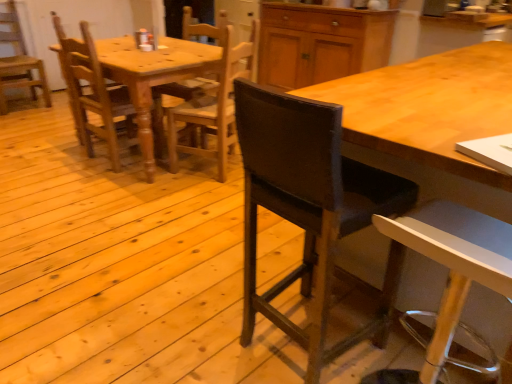
Question: Is the depth of wooden desk at center less than that of wooden chair at left, the 1th chair in the back-to-front sequence?

Choices:
 (A) yes
 (B) no

Answer: (A)

Question: Is wooden chair at left, placed as the 5th chair when sorted from right to left, a part of wooden desk at center?

Choices:
 (A) no
 (B) yes

Answer: (A)

Question: Is wooden desk at center bigger than wooden chair at left, the 1th chair in the back-to-front sequence?

Choices:
 (A) yes
 (B) no

Answer: (A)

Question: Could you tell me if wooden desk at center is facing wooden chair at left, placed as the 1th chair when sorted from left to right?

Choices:
 (A) yes
 (B) no

Answer: (A)

Question: Is wooden desk at center with wooden chair at left, placed as the 1th chair when sorted from left to right?

Choices:
 (A) no
 (B) yes

Answer: (A)

Question: Relative to wooden chair at left, the 5th chair viewed from the front, is dark brown leather chair at center, acting as the fourth chair starting from the back, in front or behind?

Choices:
 (A) front
 (B) behind

Answer: (A)

Question: Is dark brown leather chair at center, positioned as the second chair in right-to-left order, bigger or smaller than wooden chair at left, placed as the 1th chair when sorted from left to right?

Choices:
 (A) small
 (B) big

Answer: (A)

Question: In terms of height, does dark brown leather chair at center, positioned as the second chair in right-to-left order, look taller or shorter compared to wooden chair at left, the 1th chair in the back-to-front sequence?

Choices:
 (A) short
 (B) tall

Answer: (B)

Question: Considering the positions of dark brown leather chair at center, acting as the fourth chair starting from the back, and wooden chair at left, the 5th chair viewed from the front, in the image, is dark brown leather chair at center, acting as the fourth chair starting from the back, wider or thinner than wooden chair at left, the 5th chair viewed from the front,?

Choices:
 (A) thin
 (B) wide

Answer: (A)

Question: Is wooden chair at center, marked as the second chair in a left-to-right arrangement, in front of or behind white plastic stool at lower right, the first chair viewed from the front, in the image?

Choices:
 (A) behind
 (B) front

Answer: (A)

Question: From the image's perspective, is wooden chair at center, which appears as the second chair when viewed from the back, above or below white plastic stool at lower right, arranged as the first chair when viewed from the right?

Choices:
 (A) below
 (B) above

Answer: (B)

Question: Is wooden chair at center, positioned as the fourth chair in right-to-left order, taller or shorter than white plastic stool at lower right, which is counted as the fifth chair, starting from the left?

Choices:
 (A) short
 (B) tall

Answer: (B)

Question: Considering the positions of wooden chair at center, positioned as the fourth chair in right-to-left order, and white plastic stool at lower right, arranged as the first chair when viewed from the right, in the image, is wooden chair at center, positioned as the fourth chair in right-to-left order, bigger or smaller than white plastic stool at lower right, arranged as the first chair when viewed from the right,?

Choices:
 (A) small
 (B) big

Answer: (B)

Question: In the image, is wooden desk at center positioned in front of or behind dark brown leather chair at center, which is the 2th chair from front to back?

Choices:
 (A) front
 (B) behind

Answer: (A)

Question: From a real-world perspective, relative to dark brown leather chair at center, acting as the fourth chair starting from the back, is wooden desk at center vertically above or below?

Choices:
 (A) below
 (B) above

Answer: (A)